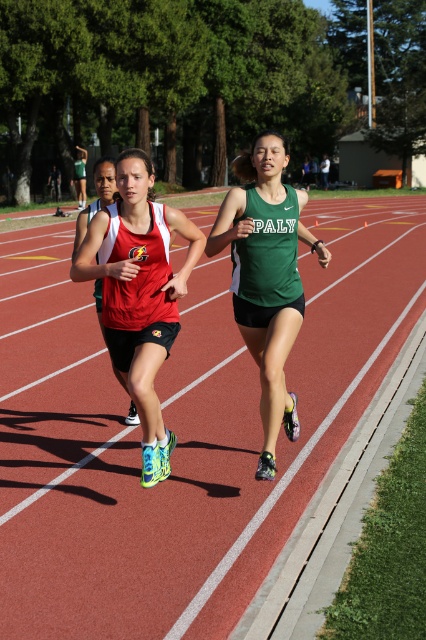
You are a photographer standing at the starting line of the track. You want to take a photo that includes both the red rubber track at center and the matte red tank top at center. Which object should you adjust your camera angle to focus on first to ensure both are in frame?

The red rubber track at center is much taller than the matte red tank top at center, so you should focus on the red rubber track at center first to accommodate its height, then adjust to include the matte red tank top at center.

You are a photographer standing at the starting line of the track and field event. You want to take a photo of the red rubber track at center and the green matte tank top at center. Which object should you zoom in more on to ensure both are clearly visible in the frame?

The red rubber track at center is wider than the green matte tank top at center, so you should zoom in more on the green matte tank top at center to ensure both are clearly visible in the frame.

You are a photographer positioned at the starting line of the track and want to capture a photo of the matte red tank top at center and the red rubber track at center. Which object is closer to the right side of the photo frame?

The matte red tank top at center is closer to the right side of the photo frame because the red rubber track at center is to the left of it.